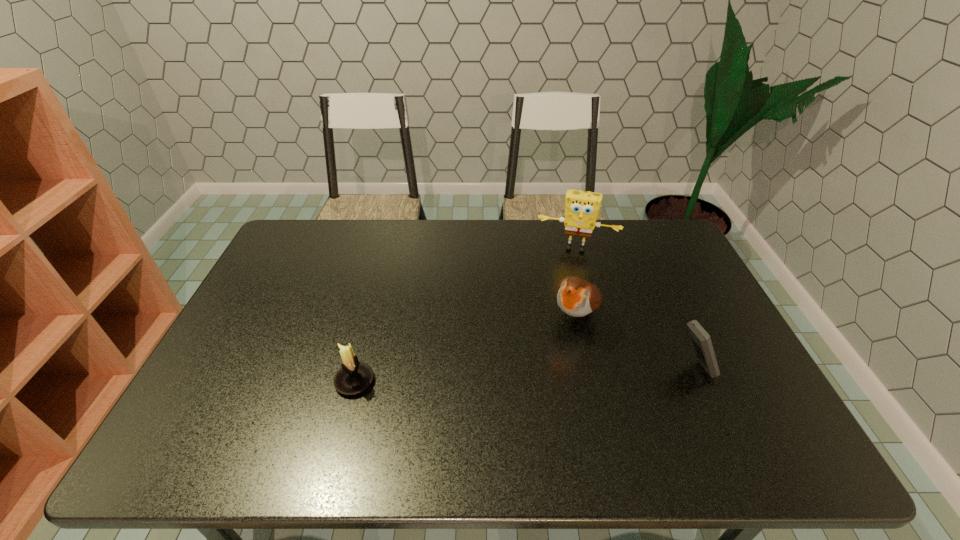
Image resolution: width=960 pixels, height=540 pixels. Identify the location of vacant space on the desktop that is between the leftmost object and the calculator and is positioned on the face of the farthest object. (558, 373).

In order to click on vacant space on the desktop that is between the leftmost object and the rightmost object and is positioned at the face of the third nearest object in this screenshot , I will do `click(537, 374)`.